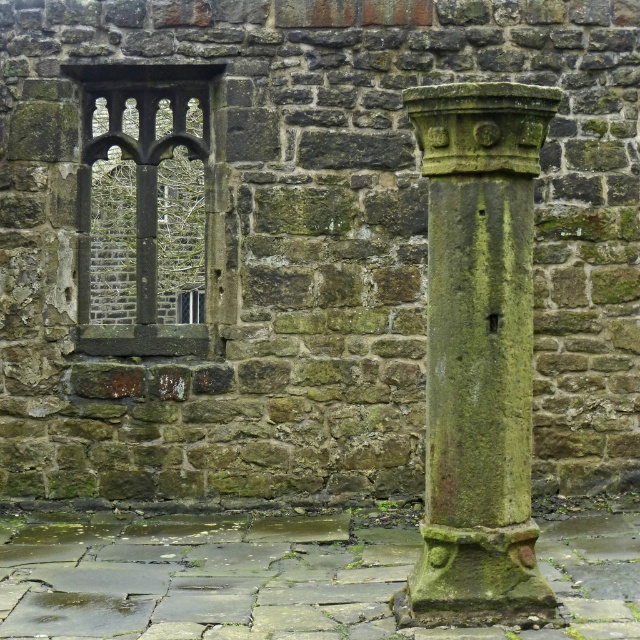
Question: Considering the relative positions of green mossy stone column at right and dark stone window at upper left in the image provided, where is green mossy stone column at right located with respect to dark stone window at upper left?

Choices:
 (A) right
 (B) left

Answer: (A)

Question: Which of the following is the closest to the observer?

Choices:
 (A) (156, 337)
 (B) (426, 497)

Answer: (B)

Question: Which point is farther to the camera?

Choices:
 (A) (179, 148)
 (B) (449, 124)

Answer: (A)

Question: Can you confirm if green mossy stone column at right is bigger than dark stone window at upper left?

Choices:
 (A) no
 (B) yes

Answer: (A)

Question: Which point is farther to the camera?

Choices:
 (A) dark stone window at upper left
 (B) green mossy stone column at right

Answer: (A)

Question: Can you confirm if green mossy stone column at right is wider than dark stone window at upper left?

Choices:
 (A) no
 (B) yes

Answer: (A)